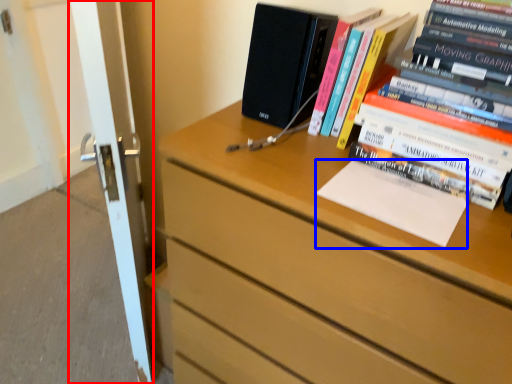
Question: Which object is closer to the camera taking this photo, screen door (highlighted by a red box) or paperback book (highlighted by a blue box)?

Choices:
 (A) screen door
 (B) paperback book

Answer: (B)